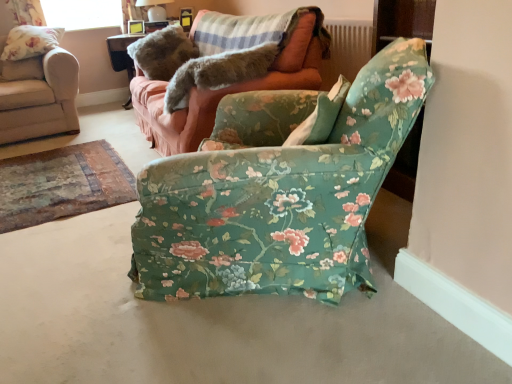
Question: Based on their positions, is furry gray cat at upper center located to the left or right of matte wooden picture frame at upper center?

Choices:
 (A) right
 (B) left

Answer: (A)

Question: Considering their positions, is furry gray cat at upper center located in front of or behind matte wooden picture frame at upper center?

Choices:
 (A) front
 (B) behind

Answer: (A)

Question: Which is farther from the floral fabric pillow at upper left?

Choices:
 (A) matte white lampshade at upper center
 (B) beige fabric chair at upper left, arranged as the second chair when viewed from the right
 (C) matte wooden picture frame at upper center
 (D) floral fabric chair at center, acting as the first chair starting from the right
 (E) floral fabric couch at center

Answer: (D)

Question: Based on their relative distances, which object is nearer to the beige fabric chair at upper left, positioned as the 1th chair in left-to-right order?

Choices:
 (A) floral fabric chair at center, the 1th chair viewed from the front
 (B) furry gray cat at upper center
 (C) floral fabric pillow at upper left
 (D) floral fabric couch at center
 (E) matte wooden picture frame at upper center

Answer: (C)